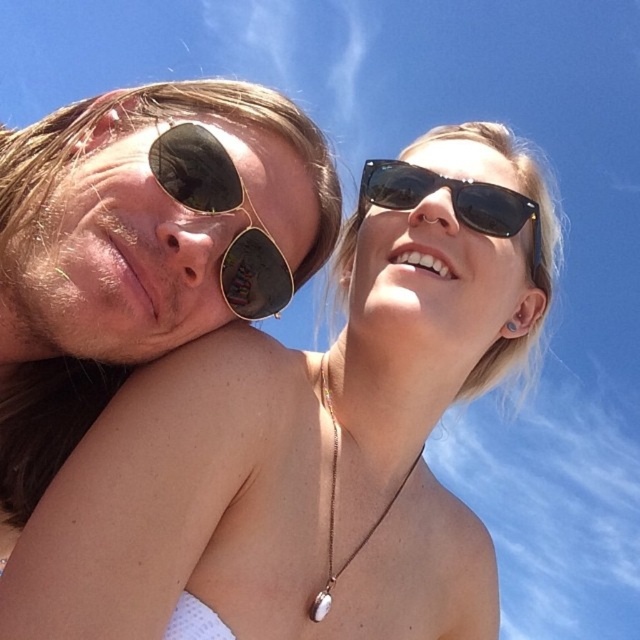
Based on the photo, is matte gold necklace at center thinner than gold mirrored sunglasses at upper left?

No.

Is matte gold necklace at center positioned behind gold mirrored sunglasses at upper left?

No, matte gold necklace at center is in front of gold mirrored sunglasses at upper left.

The height and width of the screenshot is (640, 640). I want to click on matte gold necklace at center, so click(308, 436).

Does gold mirrored sunglasses at upper left appear on the left side of black reflective sunglasses at upper right?

Indeed, gold mirrored sunglasses at upper left is positioned on the left side of black reflective sunglasses at upper right.

Does point (208, 212) come farther from viewer compared to point (419, 168)?

No, it is not.

Based on the photo, who is more distant from viewer, (186, 195) or (374, 189)?

Point (374, 189)

You are a GUI agent. You are given a task and a screenshot of the screen. Output one action in this format:
    pyautogui.click(x=<x>, y=<y>)
    Task: Click on the gold mirrored sunglasses at upper left
    The image size is (640, 640).
    Given the screenshot: What is the action you would take?
    pyautogui.click(x=224, y=212)

Does matte gold necklace at center have a larger size compared to silver metallic necklace at center?

Correct, matte gold necklace at center is larger in size than silver metallic necklace at center.

Which is in front, point (456, 224) or point (385, 515)?

Positioned in front is point (456, 224).

Image resolution: width=640 pixels, height=640 pixels. Identify the location of matte gold necklace at center. point(308,436).